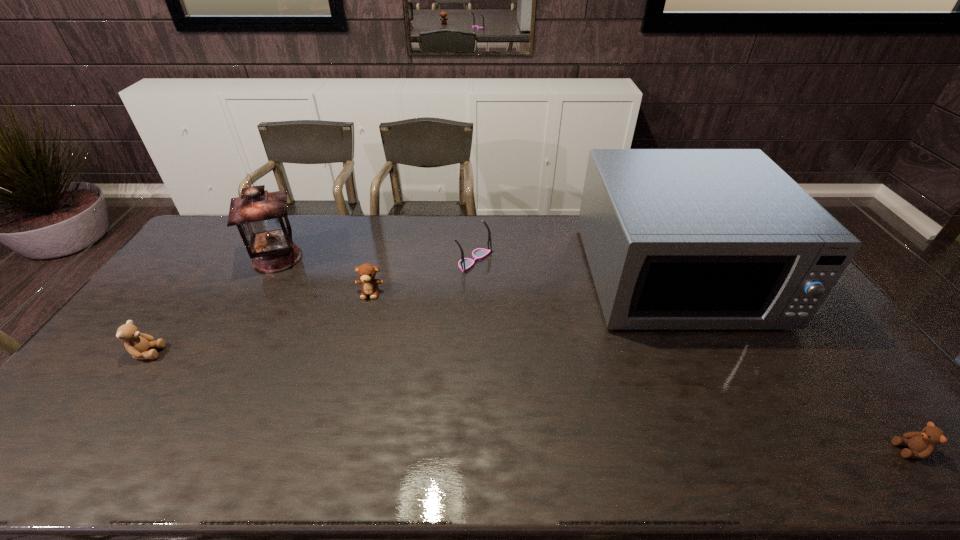
The width and height of the screenshot is (960, 540). What are the coordinates of `the second object from right to left` in the screenshot? It's located at [675, 238].

Where is `the second object from left to right`? This screenshot has height=540, width=960. the second object from left to right is located at coordinates (261, 217).

In order to click on spectacles in this screenshot , I will do `click(464, 264)`.

Where is `the farthest teddy bear`? This screenshot has width=960, height=540. the farthest teddy bear is located at coordinates (366, 272).

I want to click on the second teddy bear from left to right, so click(366, 272).

Find the location of `the leftmost teddy bear`. the leftmost teddy bear is located at coordinates (138, 344).

The image size is (960, 540). Find the location of `the leftmost object`. the leftmost object is located at coordinates (138, 344).

At what (x,y) coordinates should I click in order to perform the action: click on the nearest teddy bear. Please return your answer as a coordinate pair (x, y). This screenshot has width=960, height=540. Looking at the image, I should click on (922, 444).

Where is `the rightmost teddy bear`? the rightmost teddy bear is located at coordinates (922, 444).

Identify the location of vacant position located 0.080m with the door open on the microwave oven. (717, 357).